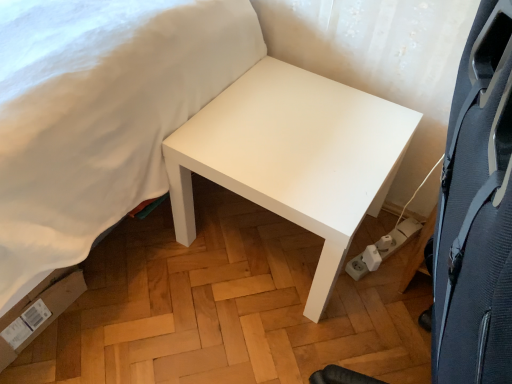
Question: Considering the relative sizes of white matte bed at upper left and white plastic socket at lower right in the image provided, is white matte bed at upper left shorter than white plastic socket at lower right?

Choices:
 (A) yes
 (B) no

Answer: (B)

Question: From a real-world perspective, is white matte bed at upper left below white plastic socket at lower right?

Choices:
 (A) no
 (B) yes

Answer: (A)

Question: Is white matte bed at upper left at the right side of white plastic socket at lower right?

Choices:
 (A) no
 (B) yes

Answer: (A)

Question: Can you confirm if white matte bed at upper left is wider than white plastic socket at lower right?

Choices:
 (A) yes
 (B) no

Answer: (A)

Question: Can you confirm if white matte bed at upper left is smaller than white plastic socket at lower right?

Choices:
 (A) yes
 (B) no

Answer: (B)

Question: Is black textured swivel chair at right to the left or to the right of white matte bed at upper left in the image?

Choices:
 (A) right
 (B) left

Answer: (A)

Question: Is black textured swivel chair at right in front of or behind white matte bed at upper left in the image?

Choices:
 (A) front
 (B) behind

Answer: (A)

Question: Is black textured swivel chair at right taller or shorter than white matte bed at upper left?

Choices:
 (A) tall
 (B) short

Answer: (A)

Question: In terms of size, does black textured swivel chair at right appear bigger or smaller than white matte bed at upper left?

Choices:
 (A) big
 (B) small

Answer: (B)

Question: Is white matte table at center in front of or behind white plastic socket at lower right in the image?

Choices:
 (A) front
 (B) behind

Answer: (A)

Question: Is white matte table at center situated inside white plastic socket at lower right or outside?

Choices:
 (A) outside
 (B) inside

Answer: (A)

Question: In terms of size, does white matte table at center appear bigger or smaller than white plastic socket at lower right?

Choices:
 (A) big
 (B) small

Answer: (A)

Question: From their relative heights in the image, would you say white matte table at center is taller or shorter than white plastic socket at lower right?

Choices:
 (A) short
 (B) tall

Answer: (B)

Question: Is white matte table at center to the left or to the right of black textured swivel chair at right in the image?

Choices:
 (A) right
 (B) left

Answer: (B)

Question: In terms of height, does white matte table at center look taller or shorter compared to black textured swivel chair at right?

Choices:
 (A) short
 (B) tall

Answer: (A)